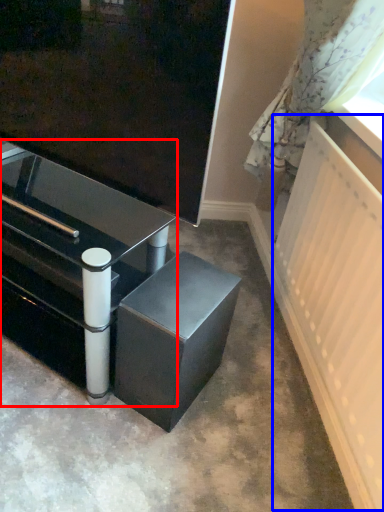
Question: Among these objects, which one is farthest to the camera, table (highlighted by a red box) or radiator (highlighted by a blue box)?

Choices:
 (A) table
 (B) radiator

Answer: (A)